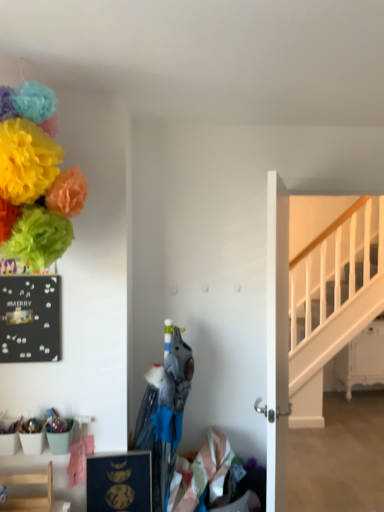
Locate an element on the screen. The width and height of the screenshot is (384, 512). white glossy door at center is located at coordinates (277, 344).

Locate an element on the screen. Image resolution: width=384 pixels, height=512 pixels. light wood chair at lower left is located at coordinates (30, 496).

Locate an element on the screen. This screenshot has height=512, width=384. black matte bulletin board at left is located at coordinates (30, 318).

This screenshot has width=384, height=512. What do you see at coordinates (119, 482) in the screenshot? I see `blue matte picture frame at lower center` at bounding box center [119, 482].

Find the location of `blue matte picture frame at lower center`. blue matte picture frame at lower center is located at coordinates (119, 482).

Identify the location of white glossy door at center. Image resolution: width=384 pixels, height=512 pixels. (277, 344).

Considering the sizes of objects white wooden stairs at right and blue matte picture frame at lower center in the image provided, who is taller, white wooden stairs at right or blue matte picture frame at lower center?

Standing taller between the two is white wooden stairs at right.

Which object is positioned more to the right, white wooden stairs at right or blue matte picture frame at lower center?

white wooden stairs at right.

Is white wooden stairs at right facing towards blue matte picture frame at lower center?

No, white wooden stairs at right is not aimed at blue matte picture frame at lower center.

Are white wooden stairs at right and blue matte picture frame at lower center far apart?

Yes, white wooden stairs at right and blue matte picture frame at lower center are quite far apart.

Between black matte bulletin board at left and white glossy door at center, which one has less height?

Standing shorter between the two is black matte bulletin board at left.

Which is correct: black matte bulletin board at left is inside white glossy door at center, or outside of it?

black matte bulletin board at left is located beyond the bounds of white glossy door at center.

Is white glossy door at center at the back of black matte bulletin board at left?

No, black matte bulletin board at left's orientation is not away from white glossy door at center.

From a real-world perspective, does black matte bulletin board at left sit lower than white glossy door at center?

No, from a real-world perspective, black matte bulletin board at left is not beneath white glossy door at center.

Can you confirm if blue matte picture frame at lower center is thinner than black matte bulletin board at left?

Incorrect, the width of blue matte picture frame at lower center is not less than that of black matte bulletin board at left.

In the scene shown: Which object is positioned more to the left, blue matte picture frame at lower center or black matte bulletin board at left?

black matte bulletin board at left is more to the left.

Are blue matte picture frame at lower center and black matte bulletin board at left located far from each other?

Actually, blue matte picture frame at lower center and black matte bulletin board at left are a little close together.

Can you confirm if white glossy door at center is thinner than black matte bulletin board at left?

No, white glossy door at center is not thinner than black matte bulletin board at left.

Where is `door below the black matte bulletin board at left (from a real-world perspective)`? door below the black matte bulletin board at left (from a real-world perspective) is located at coordinates (277, 344).

Between white glossy door at center and black matte bulletin board at left, which one has smaller size?

black matte bulletin board at left is smaller.

Is white glossy door at center oriented away from black matte bulletin board at left?

That's right, white glossy door at center is facing away from black matte bulletin board at left.

Image resolution: width=384 pixels, height=512 pixels. There is a blue matte picture frame at lower center. In order to click on bulletin board above it (from a real-world perspective) in this screenshot , I will do `click(30, 318)`.

Between point (24, 333) and point (110, 454), which one is positioned in front?

The point (24, 333) is closer to the camera.

Considering the sizes of objects black matte bulletin board at left and blue matte picture frame at lower center in the image provided, who is taller, black matte bulletin board at left or blue matte picture frame at lower center?

With more height is black matte bulletin board at left.

Could you tell me if black matte bulletin board at left is turned towards light wood chair at lower left?

No, black matte bulletin board at left is not oriented towards light wood chair at lower left.

From the picture: From the image's perspective, is black matte bulletin board at left on light wood chair at lower left?

Yes, from the image's perspective, black matte bulletin board at left is above light wood chair at lower left.

Is black matte bulletin board at left wider than light wood chair at lower left?

No, black matte bulletin board at left is not wider than light wood chair at lower left.

Find the location of a particular element. Image resolution: width=384 pixels, height=512 pixels. bulletin board that is above the light wood chair at lower left (from a real-world perspective) is located at coordinates (30, 318).

Can you tell me how much white glossy door at center and matte paper flowers at upper left differ in facing direction?

They differ by 63.2 degrees in their facing directions.

Relative to matte paper flowers at upper left, is white glossy door at center in front or behind?

white glossy door at center is positioned farther from the viewer than matte paper flowers at upper left.

From a real-world perspective, is white glossy door at center below matte paper flowers at upper left?

Yes.

Find the location of a particular element. picture frame below the white wooden stairs at right (from the image's perspective) is located at coordinates (119, 482).

I want to click on bulletin board that is above the white glossy door at center (from the image's perspective), so click(30, 318).

When comparing their distances from light wood chair at lower left, does black matte bulletin board at left or blue matte picture frame at lower center seem further?

black matte bulletin board at left.

Considering their positions, is white glossy door at center positioned further to white wooden stairs at right than matte paper flowers at upper left?

The object further to white wooden stairs at right is matte paper flowers at upper left.

Which object lies further to the anchor point black matte bulletin board at left, matte paper flowers at upper left or white glossy door at center?

Among the two, white glossy door at center is located further to black matte bulletin board at left.

From the picture: When comparing their distances from white glossy door at center, does matte paper flowers at upper left or black matte bulletin board at left seem further?

matte paper flowers at upper left lies further to white glossy door at center than the other object.

Considering their positions, is blue matte picture frame at lower center positioned further to white glossy door at center than white wooden stairs at right?

white wooden stairs at right lies further to white glossy door at center than the other object.

Consider the image. Considering their positions, is black matte bulletin board at left positioned further to white glossy door at center than matte paper flowers at upper left?

Based on the image, matte paper flowers at upper left appears to be further to white glossy door at center.

Estimate the real-world distances between objects in this image. Which object is further from white glossy door at center, blue matte picture frame at lower center or light wood chair at lower left?

The object further to white glossy door at center is light wood chair at lower left.

Estimate the real-world distances between objects in this image. Which object is closer to light wood chair at lower left, matte paper flowers at upper left or white glossy door at center?

matte paper flowers at upper left is closer to light wood chair at lower left.

I want to click on bulletin board positioned between matte paper flowers at upper left and white wooden stairs at right from near to far, so click(x=30, y=318).

You are a GUI agent. You are given a task and a screenshot of the screen. Output one action in this format:
    pyautogui.click(x=<x>, y=<y>)
    Task: Click on the bulletin board positioned between blue matte picture frame at lower center and white wooden stairs at right from near to far
    The width and height of the screenshot is (384, 512).
    Given the screenshot: What is the action you would take?
    pyautogui.click(x=30, y=318)

Identify the location of flower between black matte bulletin board at left and white glossy door at center from left to right. (35, 180).

Locate an element on the screen. furniture between black matte bulletin board at left and blue matte picture frame at lower center vertically is located at coordinates (30, 496).